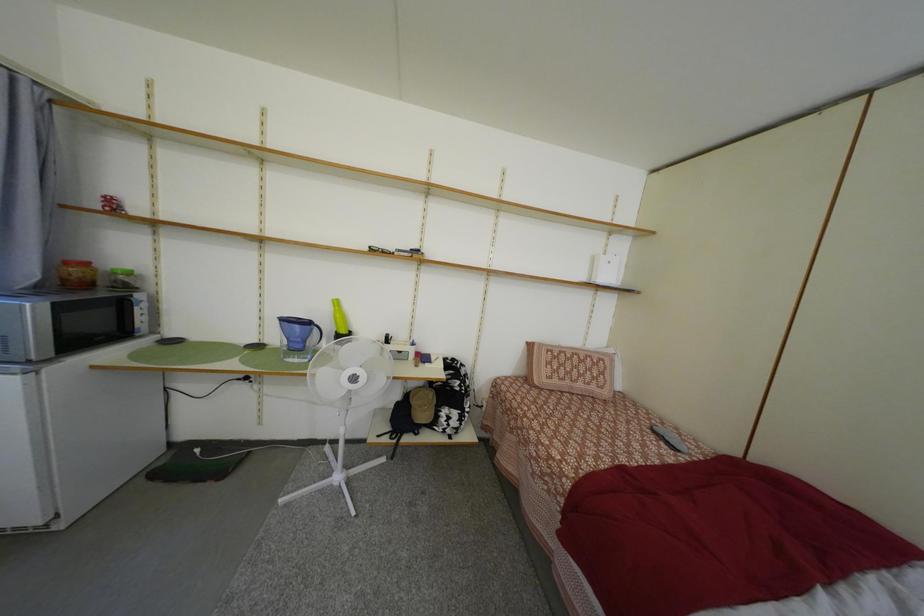
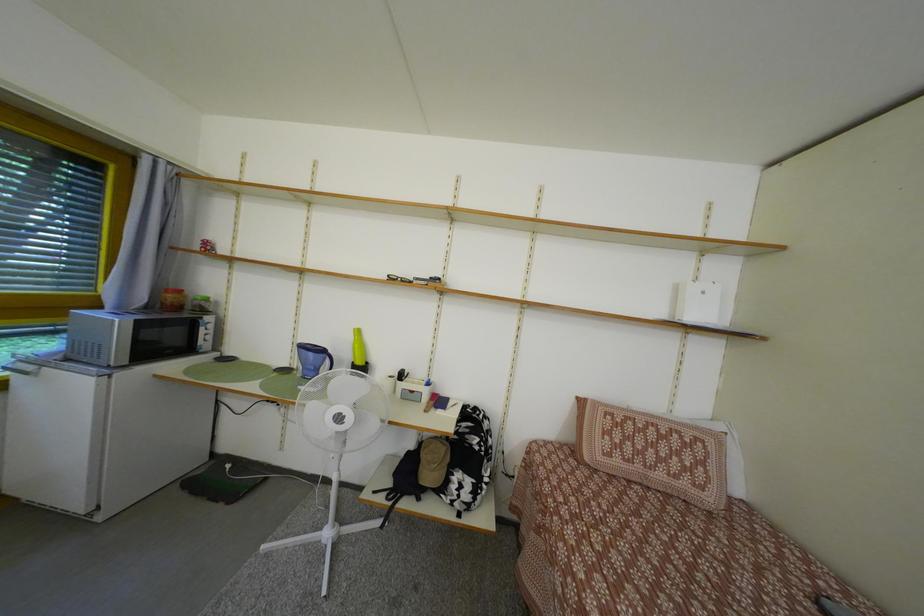
Question: Based on the continuous images, in which direction is the camera rotating? Reply with the corresponding letter.

Choices:
 (A) Left
 (B) Right
 (C) Up
 (D) Down

Answer: (A)